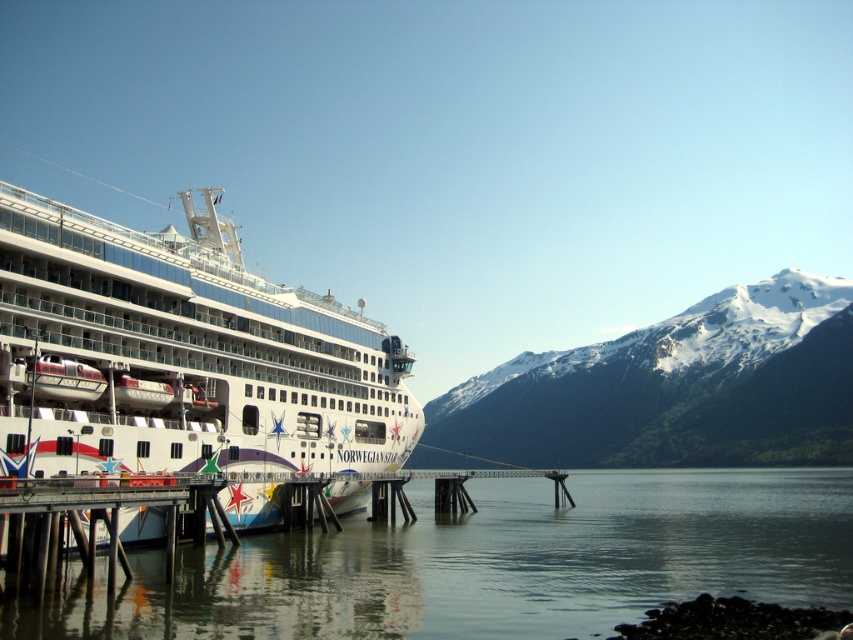
Question: Which object is farther from the camera taking this photo?

Choices:
 (A) white glossy cruise ship at left
 (B) snowy rocky mountain at right

Answer: (B)

Question: Which of the following is the farthest from the observer?

Choices:
 (A) (683, 444)
 (B) (430, 524)
 (C) (291, 387)

Answer: (A)

Question: Is white glossy cruise ship at left positioned before snowy rocky mountain at right?

Choices:
 (A) yes
 (B) no

Answer: (A)

Question: Which point is farther to the camera?

Choices:
 (A) white glossy cruise ship at left
 (B) clear water at lower left

Answer: (A)

Question: Is clear water at lower left to the left of snowy rocky mountain at right from the viewer's perspective?

Choices:
 (A) no
 (B) yes

Answer: (B)

Question: From the image, what is the correct spatial relationship of clear water at lower left in relation to snowy rocky mountain at right?

Choices:
 (A) above
 (B) below

Answer: (B)